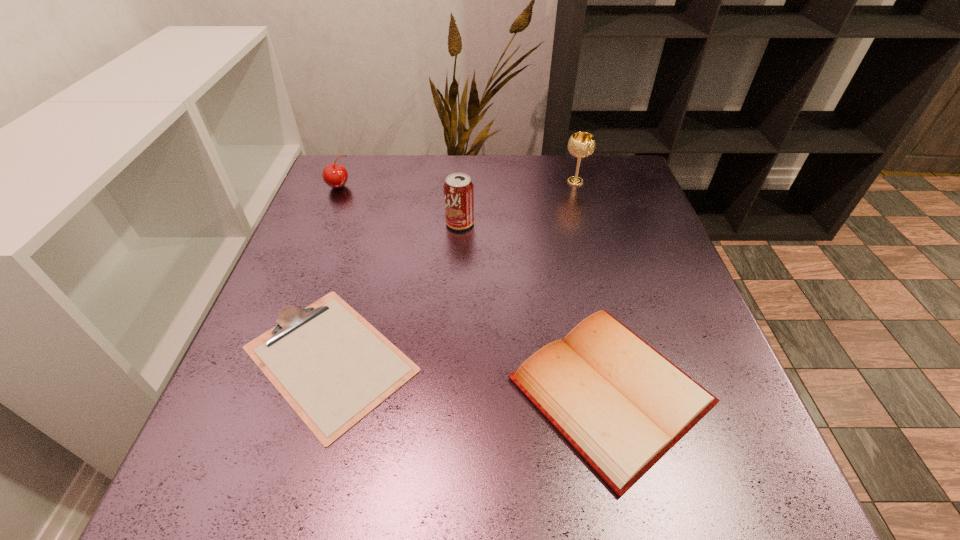
What are the coordinates of `free space located 0.160m on the back of the clipboard` in the screenshot? It's located at (364, 242).

The image size is (960, 540). I want to click on chalice situated at the far edge, so click(581, 144).

Find the location of a particular element. The height and width of the screenshot is (540, 960). cherry that is at the far edge is located at coordinates (335, 175).

In order to click on object at the near edge in this screenshot , I will do point(622,405).

Locate an element on the screen. cherry that is at the left edge is located at coordinates (335, 175).

Where is `clipboard that is at the left edge`? The height and width of the screenshot is (540, 960). clipboard that is at the left edge is located at coordinates (333, 367).

Locate an element on the screen. This screenshot has height=540, width=960. chalice that is at the right edge is located at coordinates point(581,144).

I want to click on Bible located at the right edge, so click(x=622, y=405).

At what (x,y) coordinates should I click in order to perform the action: click on object that is at the far left corner. Please return your answer as a coordinate pair (x, y). The width and height of the screenshot is (960, 540). Looking at the image, I should click on (335, 175).

This screenshot has height=540, width=960. What are the coordinates of `object that is positioned at the far right corner` in the screenshot? It's located at (581, 144).